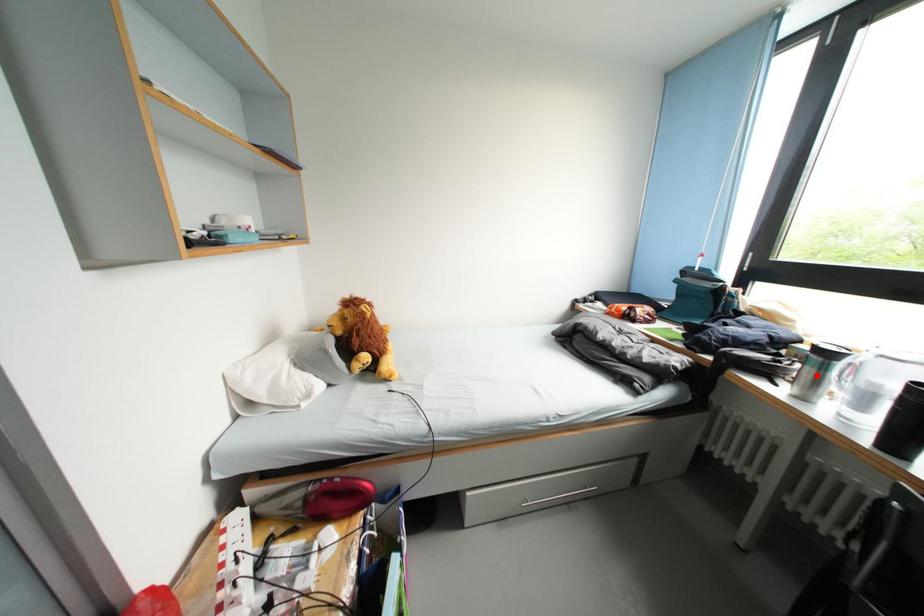
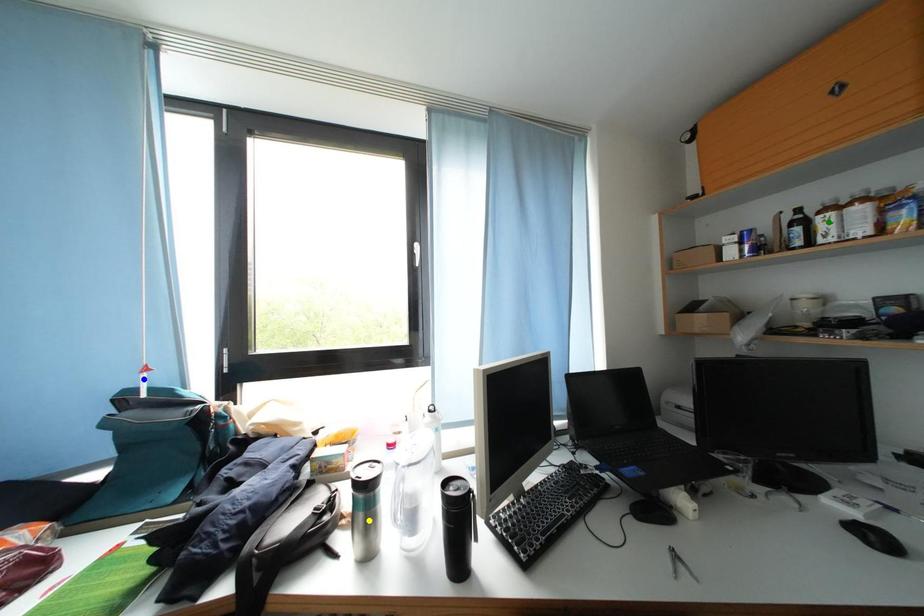
Question: I am providing you with two images of the same scene from different viewpoints. A red point is marked on the first image. You are given multiple points on the second image. Which point in image 2 represents the same 3d spot as the red point in image 1?

Choices:
 (A) yellow point
 (B) blue point
 (C) green point

Answer: (A)